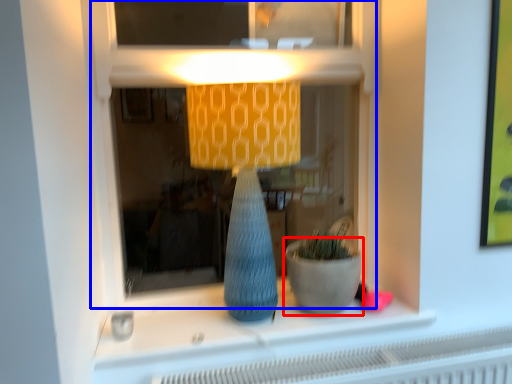
Question: Which object is closer to the camera taking this photo, flowerpot (highlighted by a red box) or shop window (highlighted by a blue box)?

Choices:
 (A) flowerpot
 (B) shop window

Answer: (B)